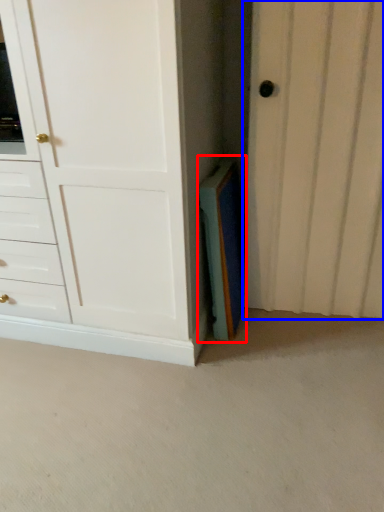
Question: Which object is closer to the camera taking this photo, paperback book (highlighted by a red box) or door (highlighted by a blue box)?

Choices:
 (A) paperback book
 (B) door

Answer: (B)